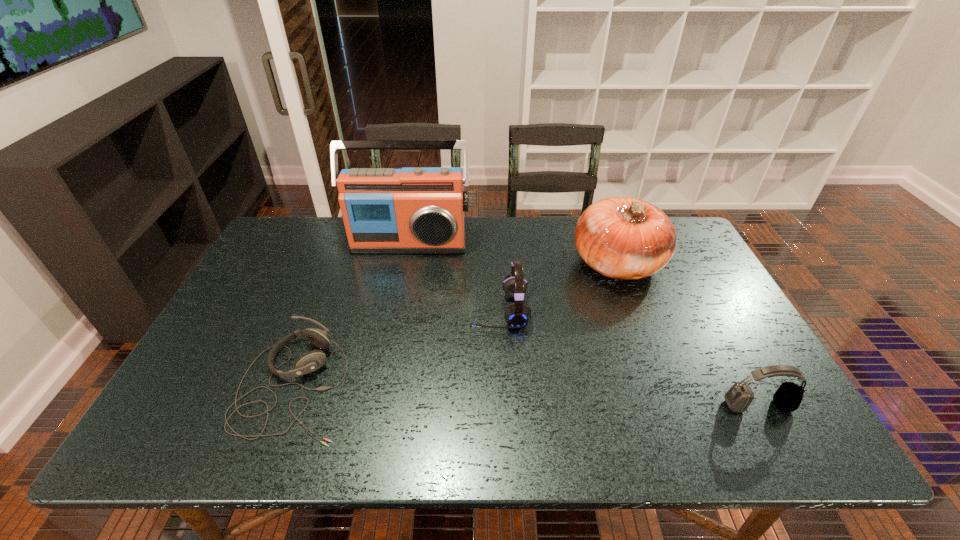
Identify the location of object located in the near left corner section of the desktop. This screenshot has height=540, width=960. (311, 361).

Image resolution: width=960 pixels, height=540 pixels. In order to click on object situated at the far right corner in this screenshot , I will do `click(624, 238)`.

Find the location of a particular element. This screenshot has height=540, width=960. vacant area at the far edge of the desktop is located at coordinates (x=503, y=235).

At what (x,y) coordinates should I click in order to perform the action: click on free spot at the near edge of the desktop. Please return your answer as a coordinate pair (x, y). The image size is (960, 540). Looking at the image, I should click on (413, 423).

You are a GUI agent. You are given a task and a screenshot of the screen. Output one action in this format:
    pyautogui.click(x=<x>, y=<y>)
    Task: Click on the free space at the left edge
    
    Given the screenshot: What is the action you would take?
    pyautogui.click(x=234, y=406)

Locate an element on the screen. This screenshot has height=540, width=960. vacant region at the right edge of the desktop is located at coordinates (679, 265).

Identify the location of free space at the far left corner. click(276, 233).

The image size is (960, 540). Identify the location of free space at the far right corner of the desktop. (677, 227).

You are a GUI agent. You are given a task and a screenshot of the screen. Output one action in this format:
    pyautogui.click(x=<x>, y=<y>)
    Task: Click on the unoccupied position between the second shortest headset and the fourth shortest object
    The image size is (960, 540).
    Given the screenshot: What is the action you would take?
    pyautogui.click(x=688, y=335)

The image size is (960, 540). Identify the location of free space between the fourth shortest object and the rightmost headset. (688, 335).